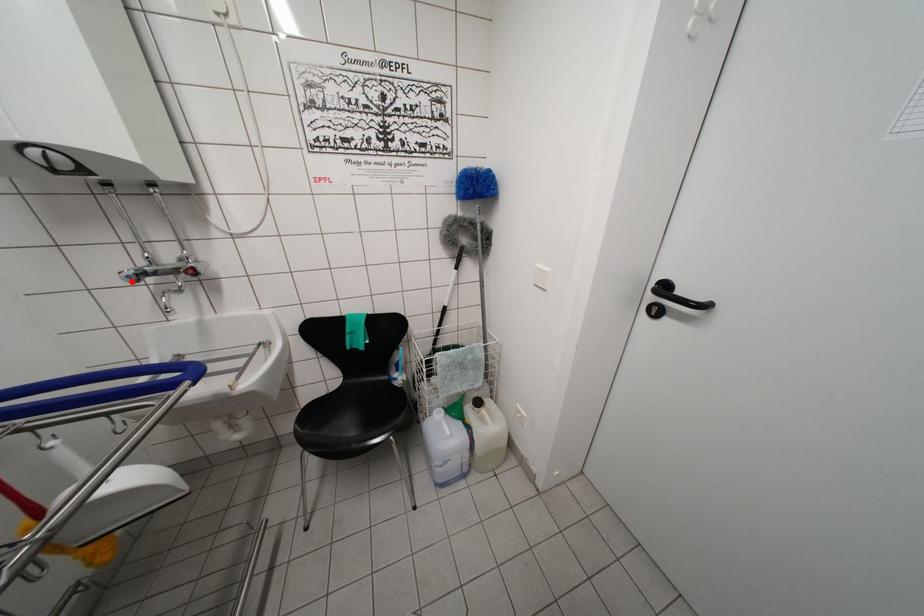
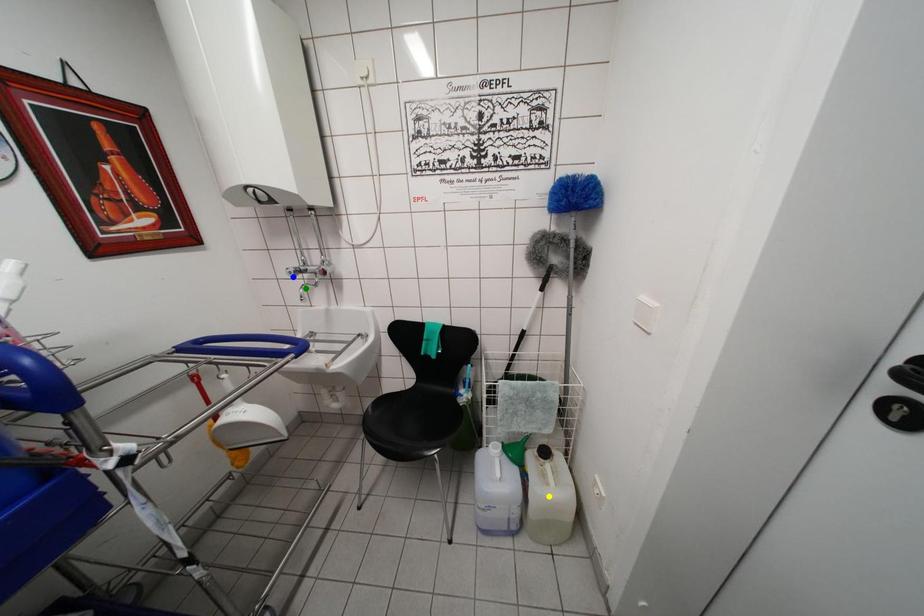
Question: I am providing you with two images of the same scene from different viewpoints. A red point is marked on the first image. You are given multiple points on the second image. In image 2, which mark is for the same physical point as the one in image 1?

Choices:
 (A) blue point
 (B) green point
 (C) yellow point

Answer: (A)